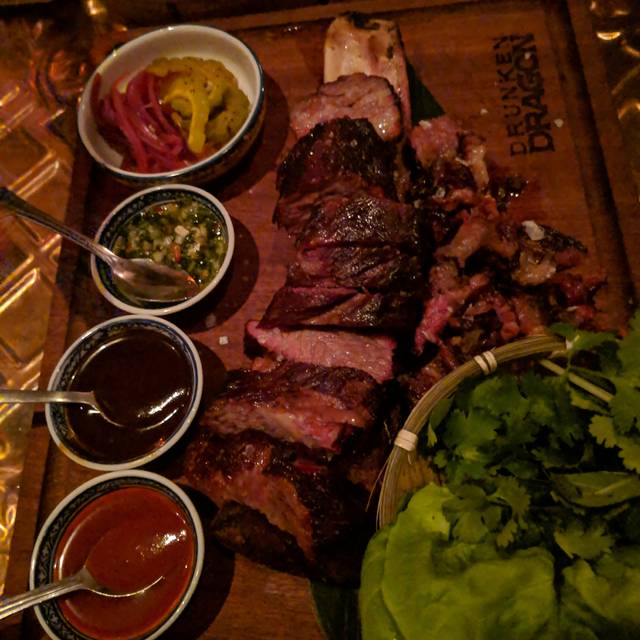
The image size is (640, 640). In order to click on spoons in this screenshot , I will do `click(98, 575)`, `click(131, 408)`, `click(157, 292)`.